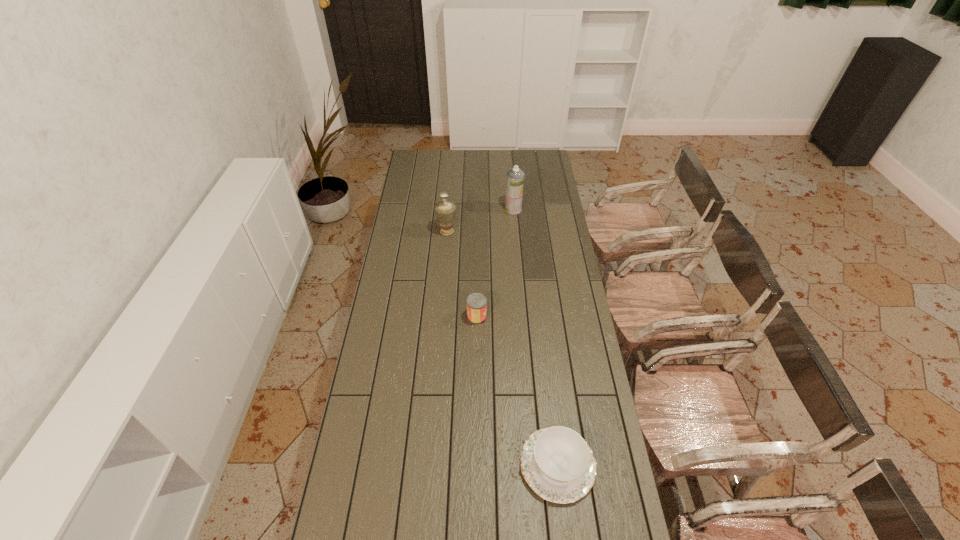
Locate an element on the screen. Image resolution: width=960 pixels, height=540 pixels. blank space located 0.160m on the handle side of the nearest object is located at coordinates point(469,465).

Locate an element on the screen. The image size is (960, 540). free region located on the handle side of the nearest object is located at coordinates (448, 465).

This screenshot has width=960, height=540. I want to click on object at the right edge, so click(557, 463).

Image resolution: width=960 pixels, height=540 pixels. I want to click on free space at the far edge, so click(x=498, y=161).

This screenshot has width=960, height=540. Identify the location of vacant space at the left edge of the desktop. (423, 211).

Where is `free space at the right edge`? The image size is (960, 540). free space at the right edge is located at coordinates (569, 253).

Identify the location of free space between the second farthest object and the third farthest object. (462, 274).

Locate an element on the screen. Image resolution: width=960 pixels, height=540 pixels. vacant space that is in between the second object from left to right and the urn is located at coordinates (462, 274).

Find the location of a particular element. This screenshot has height=540, width=960. empty space that is in between the second farthest object and the can is located at coordinates (462, 274).

You are a GUI agent. You are given a task and a screenshot of the screen. Output one action in this format:
    pyautogui.click(x=<x>, y=<y>)
    Task: Click on the vacant area that lies between the chinaware and the can
    
    Given the screenshot: What is the action you would take?
    pyautogui.click(x=517, y=390)